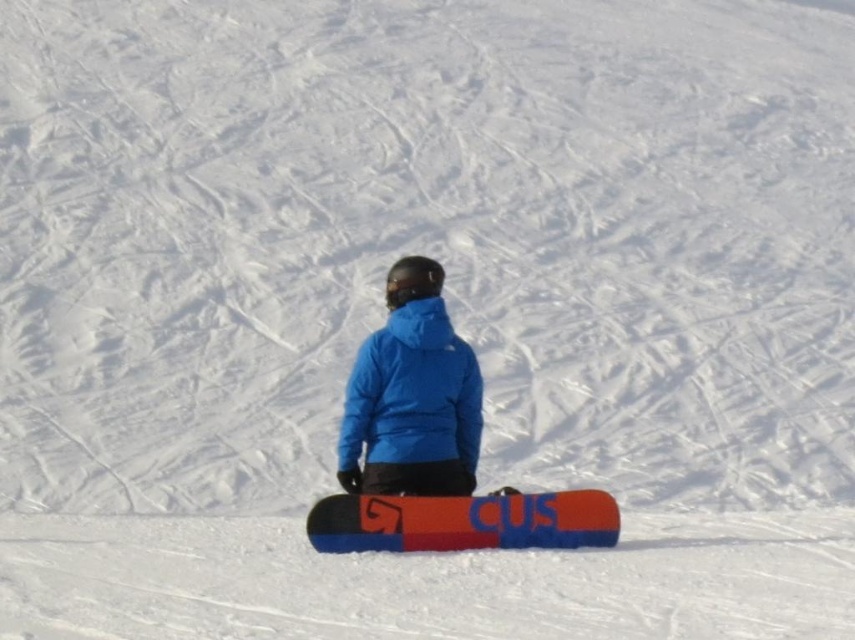
Question: Can you confirm if blue synthetic jacket at center is bigger than orange matte snowboard at center?

Choices:
 (A) no
 (B) yes

Answer: (B)

Question: Is the position of blue matte snowboarder at center more distant than that of blue synthetic jacket at center?

Choices:
 (A) no
 (B) yes

Answer: (A)

Question: Which of the following is the closest to the observer?

Choices:
 (A) (361, 504)
 (B) (364, 394)
 (C) (404, 509)

Answer: (C)

Question: Is blue matte snowboarder at center in front of blue synthetic jacket at center?

Choices:
 (A) no
 (B) yes

Answer: (B)

Question: Which of the following is the closest to the observer?

Choices:
 (A) blue synthetic jacket at center
 (B) blue matte snowboarder at center

Answer: (B)

Question: Which point is closer to the camera?

Choices:
 (A) (419, 321)
 (B) (559, 529)

Answer: (B)